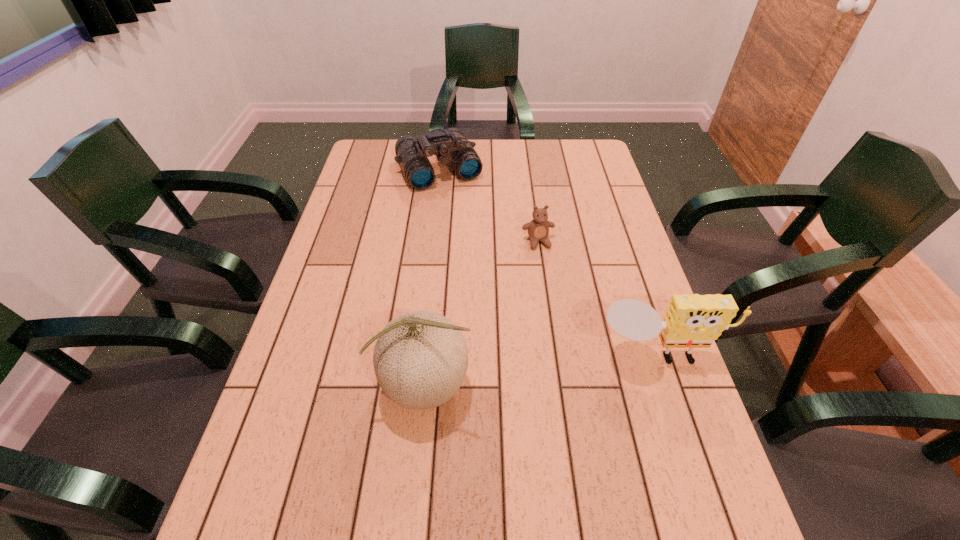
Find the location of `vacant spot on the desktop that is between the tallest object and the rightmost object and is positioned on the front-facing side of the teddy bear`. vacant spot on the desktop that is between the tallest object and the rightmost object and is positioned on the front-facing side of the teddy bear is located at coordinates (577, 366).

Find the location of a particular element. vacant spot on the desktop that is between the cantaloup and the second tallest object and is positioned through the lenses of the third tallest object is located at coordinates (549, 369).